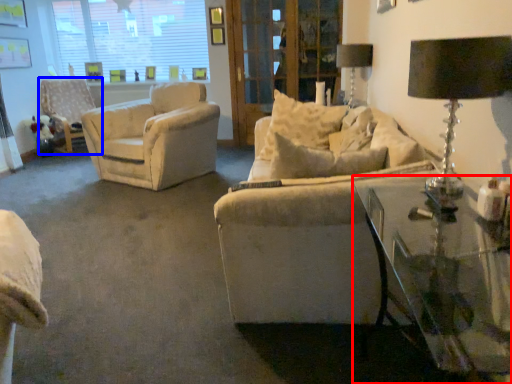
Question: Which object is closer to the camera taking this photo, table (highlighted by a red box) or chair (highlighted by a blue box)?

Choices:
 (A) table
 (B) chair

Answer: (A)